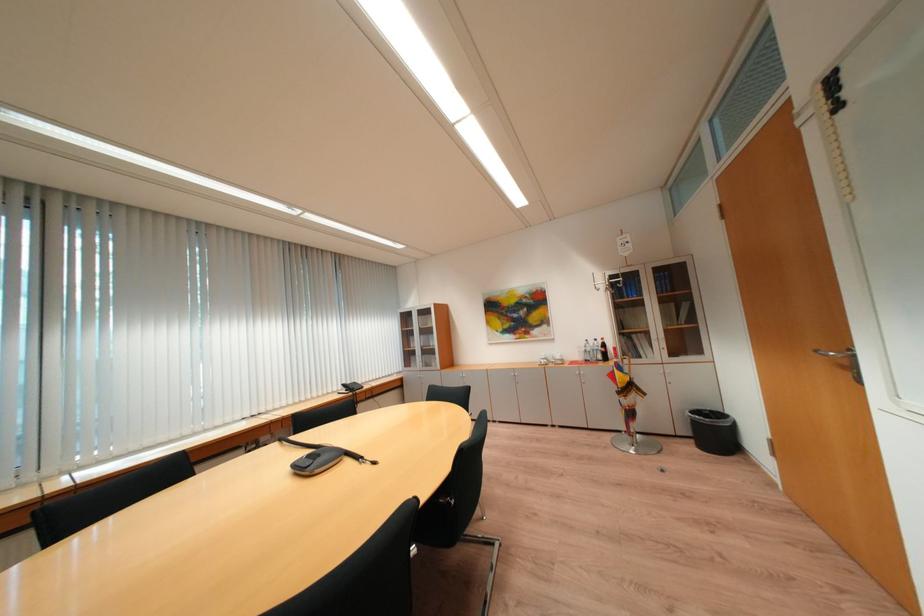
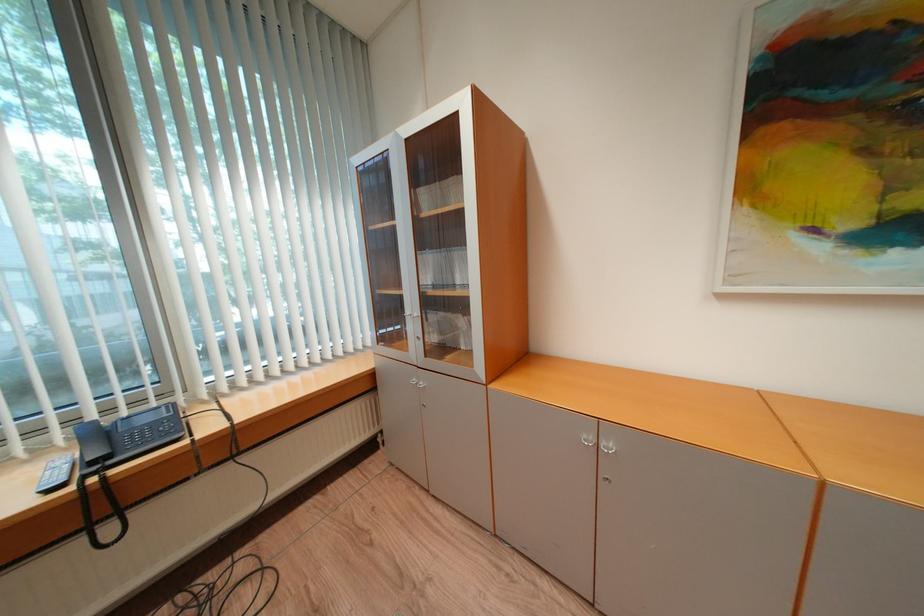
Find the pixel in the second image that matches the point at 354,387 in the first image.

(104, 434)